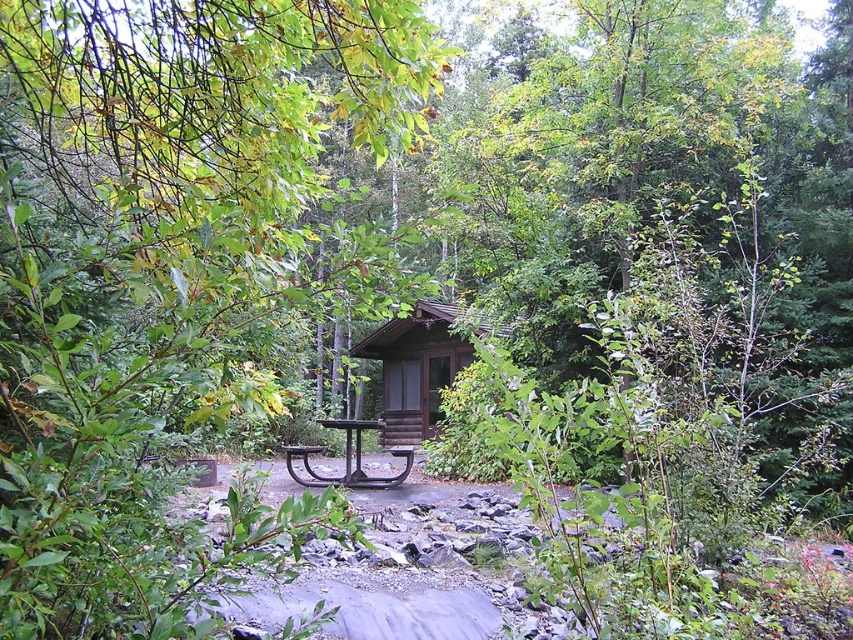
You are standing in the middle of the forest and see the brown wooden hut at center. If you want to reach the hut, in which direction should you walk?

The brown wooden hut at center is located at point 0.577 on the x axis and 0.488 on the y axis, so you should walk towards the center of the image to reach it.

You are standing at point (172, 272) in this autumn forest scene. What object is located exactly at your current position?

The green leafy tree at center is located exactly at point (172, 272).

Based on the photo, you are planning to have a picnic and want to ensure you have shade. You see a green leafy tree at center and a black wrought iron picnic table at center. Which object can provide shade for the picnic table?

The green leafy tree at center is positioned over the black wrought iron picnic table at center, so it can provide shade for the picnic table.